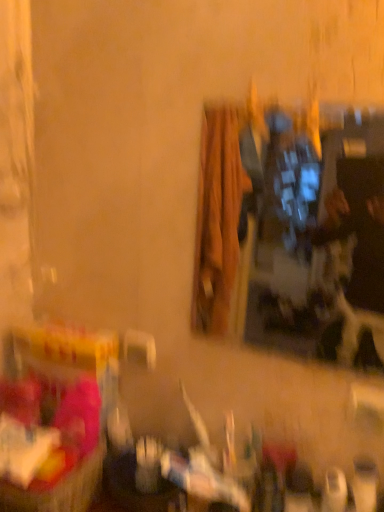
The width and height of the screenshot is (384, 512). Identify the location of metallic reflective mirror at upper right. (295, 236).

Describe the element at coordinates (295, 236) in the screenshot. The height and width of the screenshot is (512, 384). I see `metallic reflective mirror at upper right` at that location.

This screenshot has width=384, height=512. In order to click on metallic reflective mirror at upper right in this screenshot , I will do `click(295, 236)`.